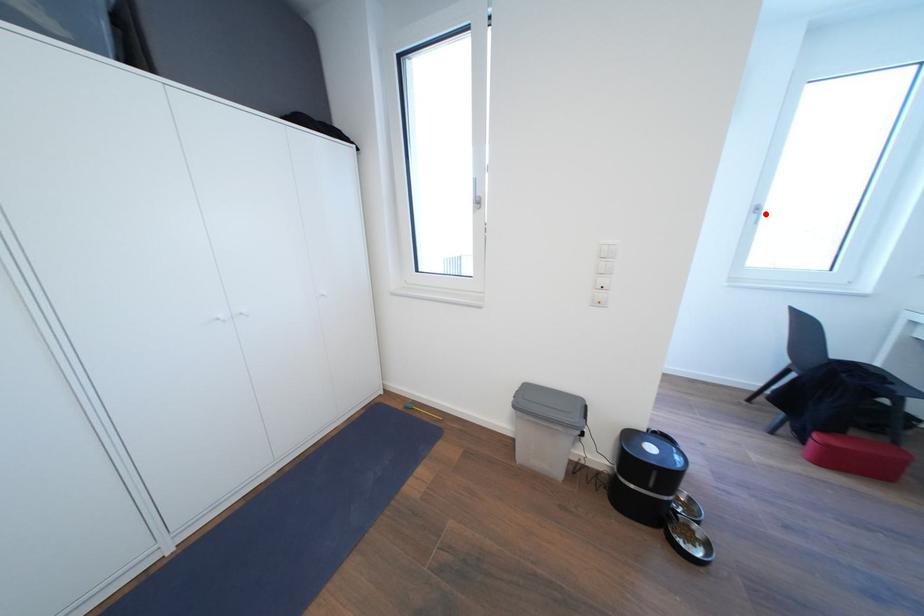
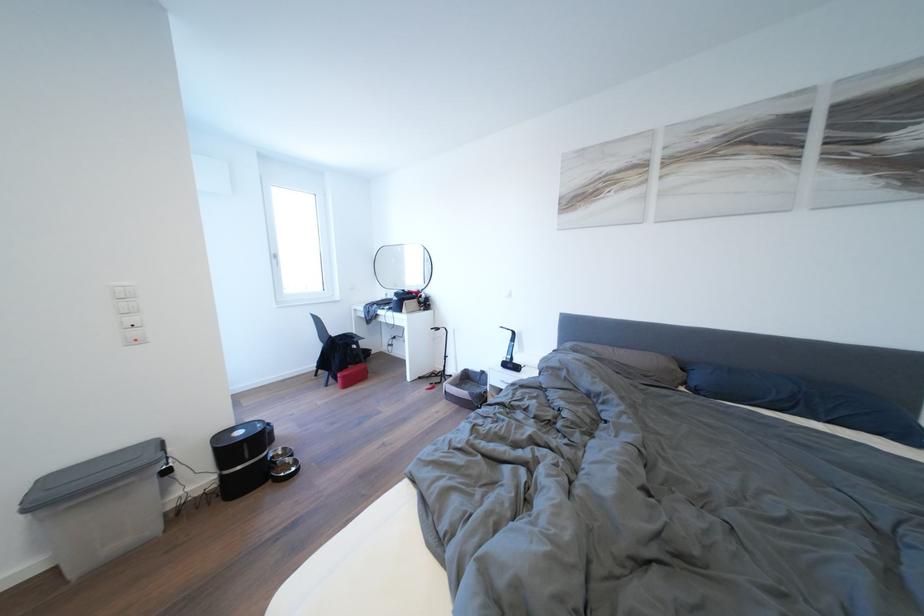
Where in the second image is the point corresponding to the highlighted location from the first image?

(284, 261)